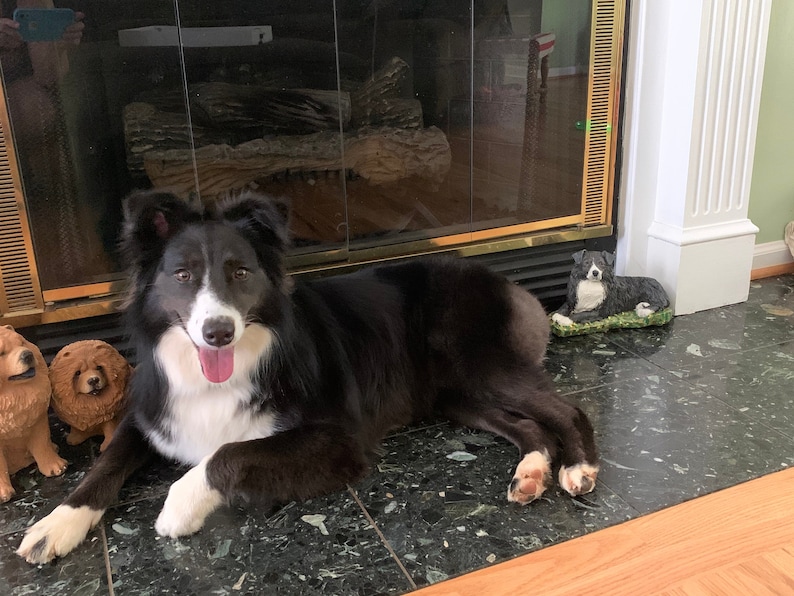
At what (x,y) coordinates should I click in order to perform the action: click on brass fireplace cover. Please return your answer as a coordinate pair (x, y). Image resolution: width=794 pixels, height=596 pixels. Looking at the image, I should click on (28, 254), (526, 229), (606, 176).